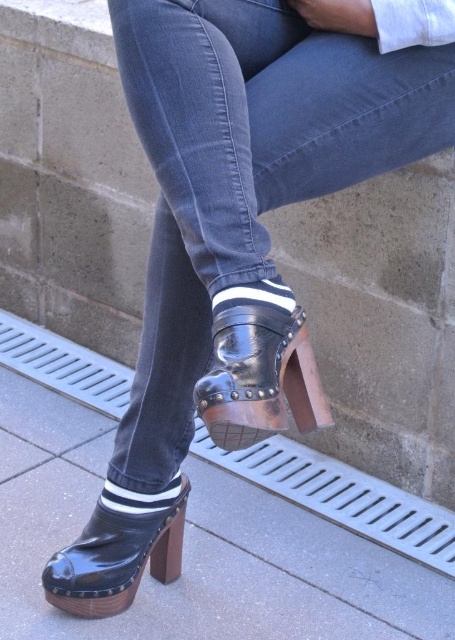
Is denim at center to the right of shiny black sandal at center from the viewer's perspective?

Correct, you'll find denim at center to the right of shiny black sandal at center.

What do you see at coordinates (256, 192) in the screenshot? This screenshot has height=640, width=455. I see `denim at center` at bounding box center [256, 192].

This screenshot has height=640, width=455. Identify the location of denim at center. (256, 192).

Who is taller, shiny black sandal at center or black patent leather platform shoe at lower center?

black patent leather platform shoe at lower center

Between point (308, 385) and point (176, 570), which one is positioned behind?

The point (176, 570) is behind.

Where is `shiny black sandal at center`? This screenshot has height=640, width=455. shiny black sandal at center is located at coordinates (258, 372).

Is denim at center wider than black patent leather platform shoe at lower center?

Correct, the width of denim at center exceeds that of black patent leather platform shoe at lower center.

Who is more distant from viewer, [312,412] or [166,524]?

Positioned behind is point [166,524].

Where is `denim at center`? denim at center is located at coordinates (256, 192).